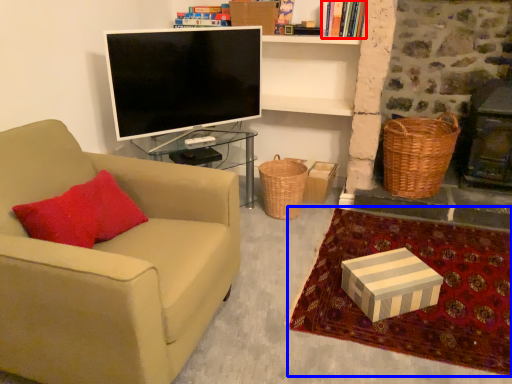
Question: Which of the following is the closest to the observer, book (highlighted by a red box) or blanket (highlighted by a blue box)?

Choices:
 (A) book
 (B) blanket

Answer: (B)